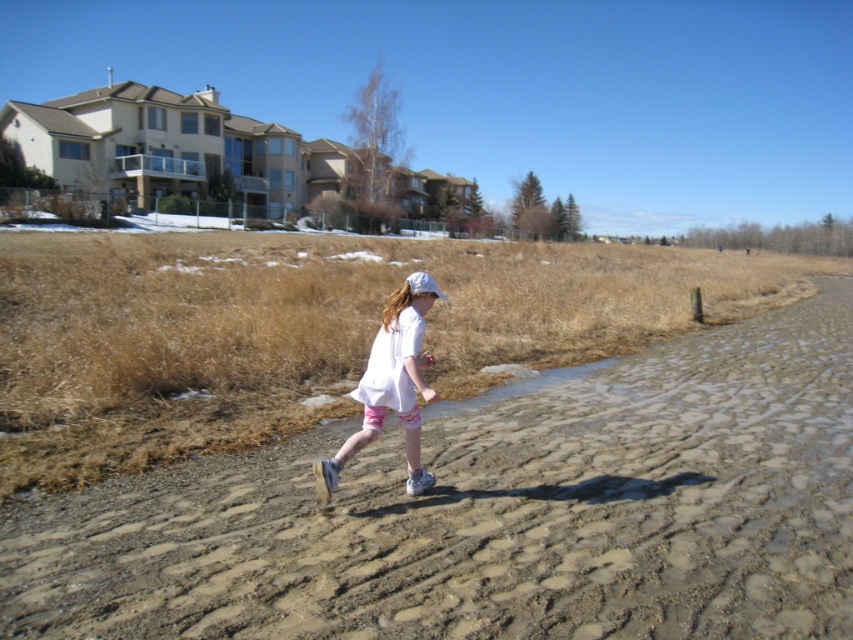
You are standing at the point with coordinates point (811,374) and want to walk to point (331,465). Which direction should you move in to get closer to your destination?

You should move towards the direction away from the camera because point (811,374) is further to the camera than point (331,465). Moving away from the camera will bring you closer to the destination.

You are a photographer trying to capture the scene from the perspective of the young girl running along the path. Which object would you see first as you look straight ahead? The brown textured dirt track at center or the white cotton shirt at center?

The white cotton shirt at center is to the left of the brown textured dirt track at center, so the photographer would see the white cotton shirt at center first when looking straight ahead.